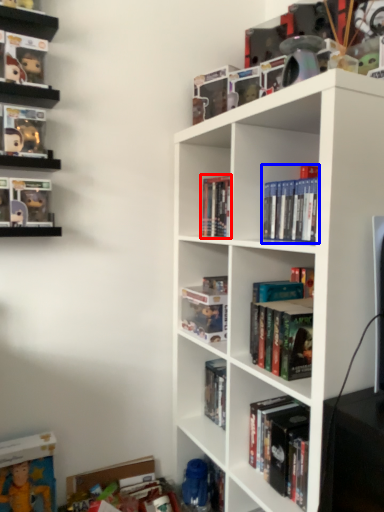
Question: Which point is closer to the camera, book (highlighted by a red box) or book (highlighted by a blue box)?

Choices:
 (A) book
 (B) book

Answer: (B)